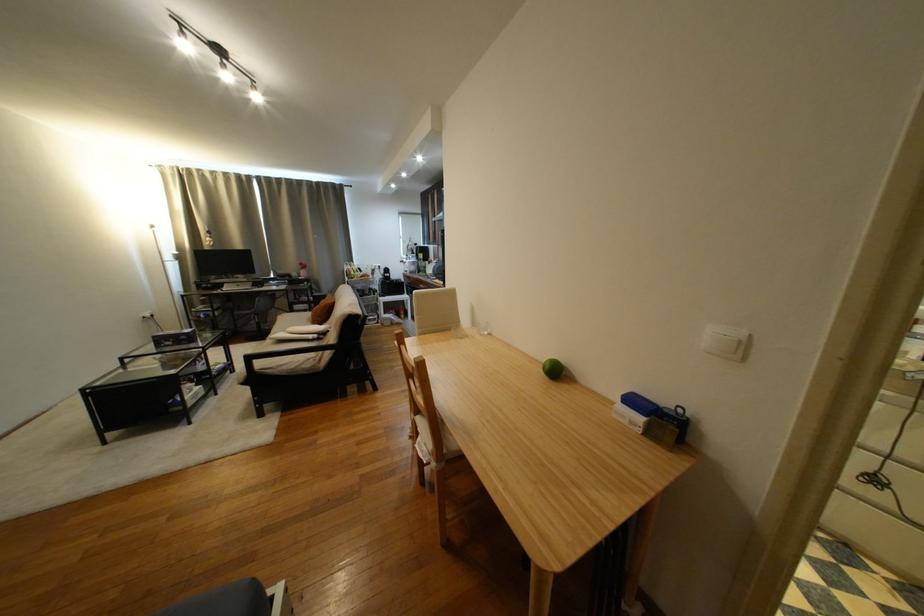
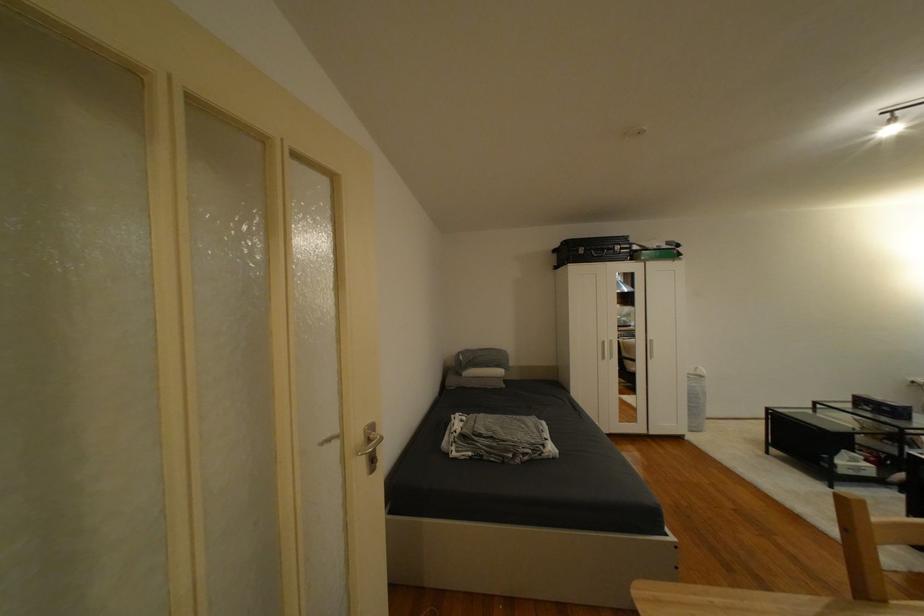
The point at (191, 339) is marked in the first image. Where is the corresponding point in the second image?

(894, 410)